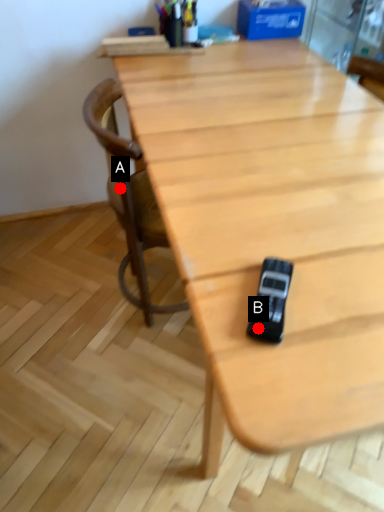
Question: Two points are circled on the image, labeled by A and B beside each circle. Which point appears closest to the camera in this image?

Choices:
 (A) A is closer
 (B) B is closer

Answer: (B)